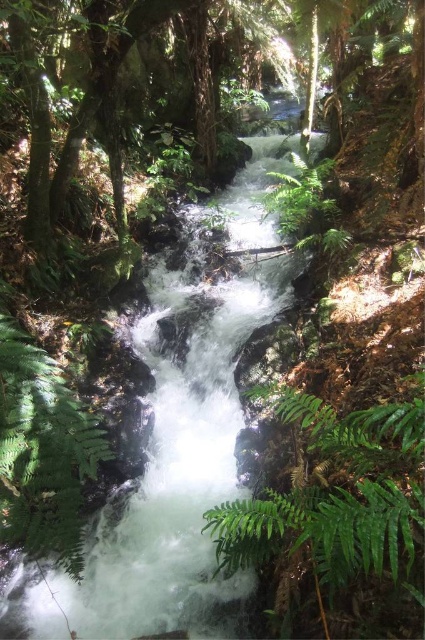
Question: Among these objects, which one is farthest from the camera?

Choices:
 (A) green fuzzy fern at lower left
 (B) green leafy fern at center

Answer: (A)

Question: Is green leafy fern at center below green fuzzy fern at lower left?

Choices:
 (A) no
 (B) yes

Answer: (B)

Question: Can you confirm if green leafy fern at center is bigger than green fuzzy fern at lower left?

Choices:
 (A) no
 (B) yes

Answer: (B)

Question: Is green leafy fern at center positioned at the back of green fuzzy fern at lower left?

Choices:
 (A) no
 (B) yes

Answer: (A)

Question: Which object is farther from the camera taking this photo?

Choices:
 (A) green leafy fern at center
 (B) green fuzzy fern at lower left

Answer: (B)